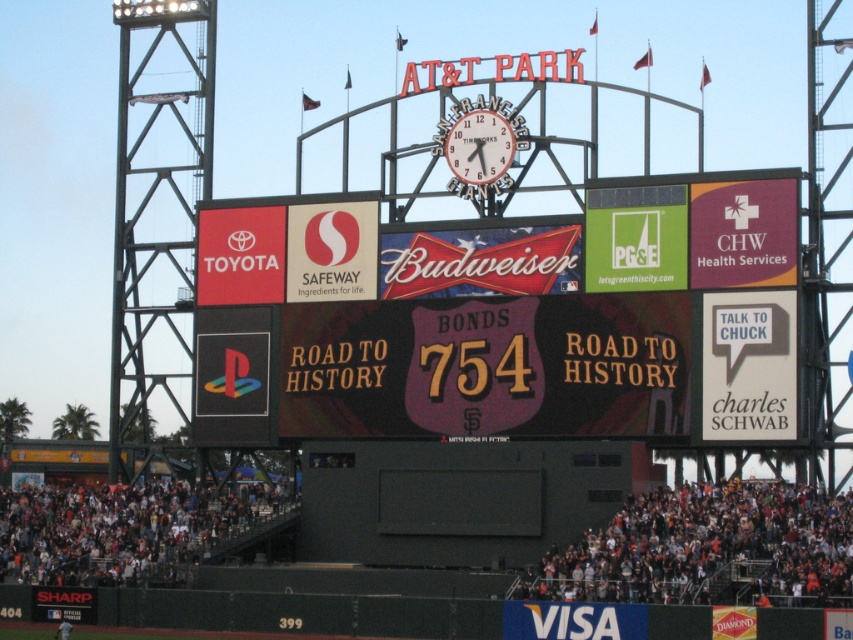
Can you confirm if black matte scoreboard at center is positioned to the left of white metallic clock at center?

Indeed, black matte scoreboard at center is positioned on the left side of white metallic clock at center.

Image resolution: width=853 pixels, height=640 pixels. I want to click on black matte scoreboard at center, so click(x=505, y=323).

Is point (722, 412) positioned after point (469, 144)?

No, (722, 412) is closer to viewer.

Find the location of a particular element. The height and width of the screenshot is (640, 853). black matte scoreboard at center is located at coordinates (505, 323).